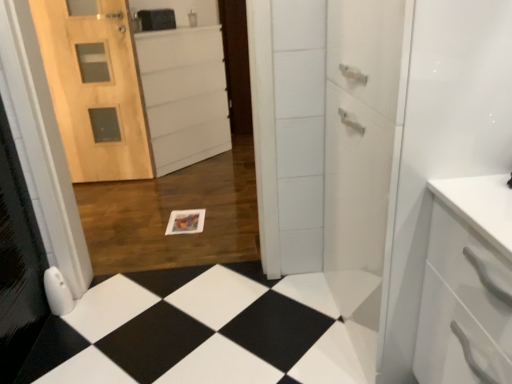
What do you see at coordinates (95, 88) in the screenshot?
I see `natural wood door at left` at bounding box center [95, 88].

Measure the distance between natural wood door at left and camera.

A distance of 8.76 feet exists between natural wood door at left and camera.

Where is `black glossy tile at lower center`? The width and height of the screenshot is (512, 384). black glossy tile at lower center is located at coordinates 200,331.

Does white matte cabinet at center touch black glossy tile at lower center?

white matte cabinet at center and black glossy tile at lower center are clearly separated.

Which of these two, white matte cabinet at center or black glossy tile at lower center, is bigger?

With larger size is white matte cabinet at center.

Who is shorter, white matte cabinet at center or black glossy tile at lower center?

black glossy tile at lower center.

Where is `square that is under the white matte cabinet at center (from a real-world perspective)`? square that is under the white matte cabinet at center (from a real-world perspective) is located at coordinates (200, 331).

Consider the image. Does white matte cabinet at center turn towards natural wood door at left?

No, white matte cabinet at center does not turn towards natural wood door at left.

Considering their positions, is white matte cabinet at center located in front of or behind natural wood door at left?

Visually, white matte cabinet at center is located behind natural wood door at left.

In the scene shown: Can you confirm if white matte cabinet at center is bigger than natural wood door at left?

Indeed, white matte cabinet at center has a larger size compared to natural wood door at left.

In order to click on square that is in front of the natural wood door at left in this screenshot , I will do `click(200, 331)`.

Looking at this image, is black glossy tile at lower center to the right of natural wood door at left from the viewer's perspective?

Correct, you'll find black glossy tile at lower center to the right of natural wood door at left.

Is the depth of black glossy tile at lower center less than that of natural wood door at left?

Yes.

Does black glossy tile at lower center have a smaller size compared to white matte cabinet at center?

Yes, black glossy tile at lower center is smaller than white matte cabinet at center.

Is black glossy tile at lower center wider than white matte cabinet at center?

Yes, black glossy tile at lower center is wider than white matte cabinet at center.

Is black glossy tile at lower center looking in the opposite direction of white matte cabinet at center?

No, black glossy tile at lower center is not facing away from white matte cabinet at center.

From a real-world perspective, between black glossy tile at lower center and white matte cabinet at center, who is vertically higher?

→ white matte cabinet at center.

From a real-world perspective, is natural wood door at left positioned above or below black glossy tile at lower center?

In terms of real-world spatial position, natural wood door at left is above black glossy tile at lower center.

Can we say natural wood door at left lies outside black glossy tile at lower center?

natural wood door at left is positioned outside black glossy tile at lower center.

Is natural wood door at left not near black glossy tile at lower center?

Yes.

Which of these two, natural wood door at left or white matte cabinet at center, is wider?

white matte cabinet at center is wider.

How different are the orientations of natural wood door at left and white matte cabinet at center in degrees?

The angular difference between natural wood door at left and white matte cabinet at center is 48.2 degrees.

Choose the correct answer: Is natural wood door at left inside white matte cabinet at center or outside it?

The correct answer is: outside.

Would you say natural wood door at left is to the left or to the right of white matte cabinet at center in the picture?

natural wood door at left is to the left of white matte cabinet at center.

Find the location of a particular element. The height and width of the screenshot is (384, 512). cabinetry that is above the black glossy tile at lower center (from the image's perspective) is located at coordinates (184, 95).

Locate an element on the screen. cabinetry below the natural wood door at left (from a real-world perspective) is located at coordinates (184, 95).

Looking at the image, which one is located closer to natural wood door at left, black glossy tile at lower center or white matte cabinet at center?

Among the two, white matte cabinet at center is located nearer to natural wood door at left.

Estimate the real-world distances between objects in this image. Which object is further from black glossy tile at lower center, white matte cabinet at center or natural wood door at left?

white matte cabinet at center.

Considering their positions, is white matte cabinet at center positioned further to natural wood door at left than black glossy tile at lower center?

black glossy tile at lower center.

Based on their spatial positions, is natural wood door at left or black glossy tile at lower center closer to white matte cabinet at center?

natural wood door at left.

From the image, which object appears to be nearer to white matte cabinet at center, black glossy tile at lower center or natural wood door at left?

The object closer to white matte cabinet at center is natural wood door at left.

Looking at the image, which one is located closer to black glossy tile at lower center, natural wood door at left or white matte cabinet at center?

natural wood door at left.

Identify the location of door between black glossy tile at lower center and white matte cabinet at center along the z-axis. Image resolution: width=512 pixels, height=384 pixels. (95, 88).